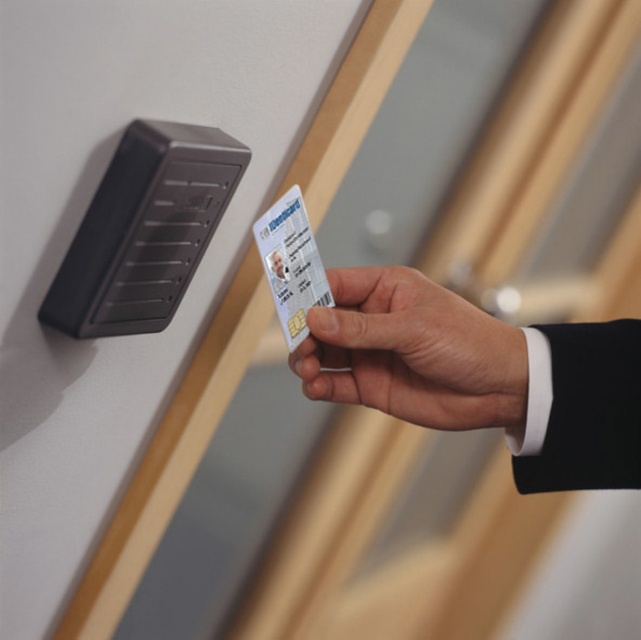
Can you confirm if white matte id card at upper right is positioned to the left of white plastic card at center?

Incorrect, white matte id card at upper right is not on the left side of white plastic card at center.

I want to click on white matte id card at upper right, so click(413, 353).

This screenshot has width=641, height=640. Find the location of `white matte id card at upper right`. white matte id card at upper right is located at coordinates (413, 353).

Is white matte id card at center smaller than black plastic lock at upper left?

No.

Does white matte id card at center have a larger size compared to black plastic lock at upper left?

Correct, white matte id card at center is larger in size than black plastic lock at upper left.

Which is in front, point (329, 387) or point (222, 205)?

Point (222, 205) is in front.

Locate an element on the screen. white matte id card at center is located at coordinates (412, 353).

Between black plastic lock at upper left and white plastic card at center, which one appears on the left side from the viewer's perspective?

black plastic lock at upper left

Is point (142, 182) closer to camera compared to point (267, 260)?

Yes, it is.

The width and height of the screenshot is (641, 640). What are the coordinates of `black plastic lock at upper left` in the screenshot? It's located at (144, 230).